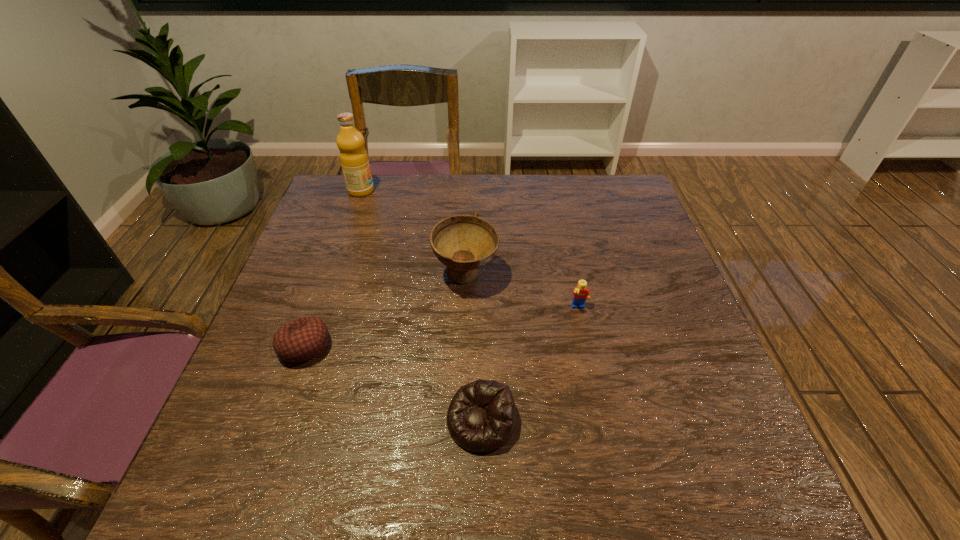
This screenshot has height=540, width=960. What are the coordinates of `vacant region at the far edge` in the screenshot? It's located at (465, 176).

Locate an element on the screen. vacant space at the near edge of the desktop is located at coordinates (658, 469).

I want to click on free spot at the left edge of the desktop, so click(345, 226).

This screenshot has height=540, width=960. In order to click on free point at the right edge in this screenshot , I will do `click(609, 243)`.

At what (x,y) coordinates should I click in order to perform the action: click on vacant space at the far right corner of the desktop. Please return your answer as a coordinate pair (x, y). Looking at the image, I should click on (602, 212).

The image size is (960, 540). In order to click on free space between the tallest object and the second tallest object in this screenshot , I will do `click(414, 233)`.

Identify the location of empty space that is in between the Lego and the left beanbag. (442, 327).

The image size is (960, 540). I want to click on unoccupied position between the tallest object and the nearer beanbag, so tap(420, 306).

Locate an element on the screen. The image size is (960, 540). vacant region between the farther beanbag and the third tallest object is located at coordinates coord(442,327).

At what (x,y) coordinates should I click in order to perform the action: click on free space between the nearest object and the fourth shortest object. Please return your answer as a coordinate pair (x, y). The width and height of the screenshot is (960, 540). Looking at the image, I should click on (473, 349).